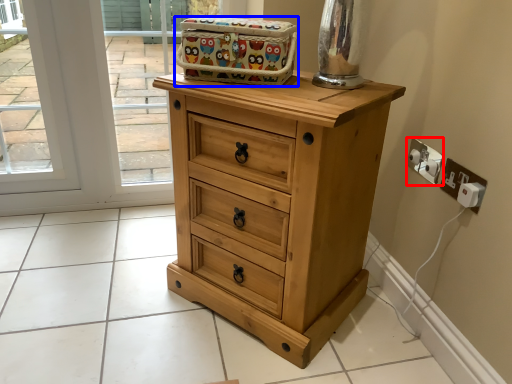
Question: Which point is closer to the camera, electric outlet (highlighted by a red box) or crate (highlighted by a blue box)?

Choices:
 (A) electric outlet
 (B) crate

Answer: (B)